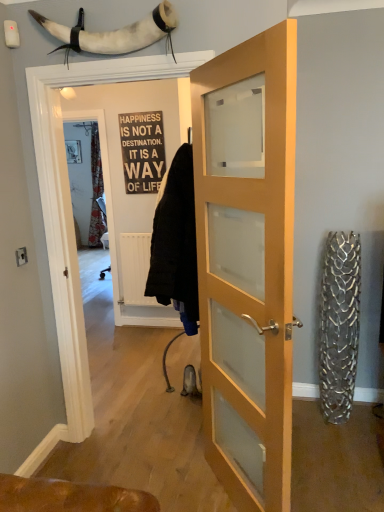
What is the approximate height of white horn at upper center?

The height of white horn at upper center is 9.64 inches.

This screenshot has width=384, height=512. What do you see at coordinates (113, 33) in the screenshot?
I see `white horn at upper center` at bounding box center [113, 33].

Measure the distance between black wood sign at center and camera.

The distance of black wood sign at center from camera is 12.17 feet.

The image size is (384, 512). I want to click on light wood/glass door at center, so click(247, 262).

Is white horn at upper center turned away from light wood/glass door at center?

No, white horn at upper center is not facing the opposite direction of light wood/glass door at center.

Which of these two, white horn at upper center or light wood/glass door at center, stands taller?

With more height is light wood/glass door at center.

Would you say white horn at upper center is outside light wood/glass door at center?

Indeed, white horn at upper center is completely outside light wood/glass door at center.

From a real-world perspective, which object rests below the other?

light wood/glass door at center, from a real-world perspective.

From the image's perspective, is light wood/glass door at center above or below white horn at upper center?

From the image's perspective, light wood/glass door at center appears below white horn at upper center.

From a real-world perspective, is light wood/glass door at center positioned under white horn at upper center based on gravity?

Yes.

Is light wood/glass door at center surrounding white horn at upper center?

No, white horn at upper center is not surrounded by light wood/glass door at center.

Considering the positions of points (144, 191) and (272, 119), is point (144, 191) farther from camera compared to point (272, 119)?

Yes, it is.

Is black wood sign at center aimed at light wood/glass door at center?

No, black wood sign at center is not facing towards light wood/glass door at center.

Is there a large distance between black wood sign at center and light wood/glass door at center?

That's right, there is a large distance between black wood sign at center and light wood/glass door at center.

Is light wood/glass door at center a part of black wood sign at center?

No, light wood/glass door at center is located outside of black wood sign at center.

Is black wood sign at center to the right of white horn at upper center from the viewer's perspective?

No.

From a real-world perspective, is black wood sign at center physically located above or below white horn at upper center?

Clearly, from a real-world perspective, black wood sign at center is below white horn at upper center.

Is black wood sign at center looking in the opposite direction of white horn at upper center?

No, black wood sign at center is not facing the opposite direction of white horn at upper center.

Does black wood sign at center have a larger size compared to white horn at upper center?

Incorrect, black wood sign at center is not larger than white horn at upper center.

Which object is positioned more to the right, white horn at upper center or black wood sign at center?

From the viewer's perspective, white horn at upper center appears more on the right side.

Who is smaller, white horn at upper center or black wood sign at center?

black wood sign at center is smaller.

Does white horn at upper center have a greater height compared to black wood sign at center?

No.

Between light wood/glass door at center and black wood sign at center, which one has larger width?

With larger width is light wood/glass door at center.

Which of these two, light wood/glass door at center or black wood sign at center, stands taller?

Standing taller between the two is light wood/glass door at center.

Is point (231, 419) less distant than point (122, 153)?

Yes, point (231, 419) is closer to viewer.

The width and height of the screenshot is (384, 512). Identify the location of door that appears on the right of white horn at upper center. (247, 262).

The image size is (384, 512). I want to click on animal lying behind the light wood/glass door at center, so click(x=113, y=33).

From the picture: Estimate the real-world distances between objects in this image. Which object is further from black wood sign at center, light wood/glass door at center or white horn at upper center?

light wood/glass door at center is further to black wood sign at center.

Estimate the real-world distances between objects in this image. Which object is closer to white horn at upper center, light wood/glass door at center or black wood sign at center?

The object closer to white horn at upper center is light wood/glass door at center.

Considering their positions, is black wood sign at center positioned closer to light wood/glass door at center than white horn at upper center?

Among the two, white horn at upper center is located nearer to light wood/glass door at center.

From the image, which object appears to be nearer to black wood sign at center, white horn at upper center or light wood/glass door at center?

white horn at upper center.

When comparing their distances from white horn at upper center, does black wood sign at center or light wood/glass door at center seem closer?

light wood/glass door at center is closer to white horn at upper center.

In the scene shown: Estimate the real-world distances between objects in this image. Which object is further from light wood/glass door at center, white horn at upper center or black wood sign at center?

Among the two, black wood sign at center is located further to light wood/glass door at center.

The image size is (384, 512). In order to click on animal between light wood/glass door at center and black wood sign at center along the z-axis in this screenshot , I will do `click(113, 33)`.